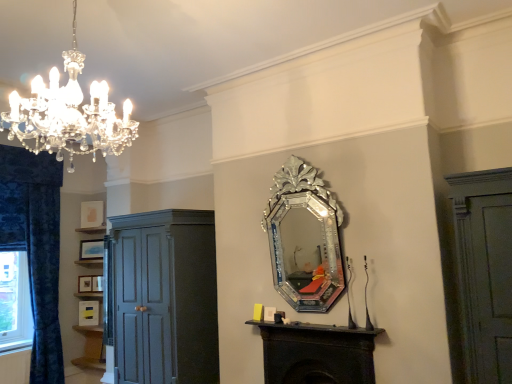
What do you see at coordinates (88, 313) in the screenshot? Image resolution: width=512 pixels, height=384 pixels. I see `matte yellow picture frame at lower left, the 1th picture frame positioned from the bottom` at bounding box center [88, 313].

How much space does matte white picture frame at center, the 3th picture frame viewed from the top, occupy horizontally?

matte white picture frame at center, the 3th picture frame viewed from the top, is 0.90 inches wide.

Locate an element on the screen. matte white picture frame at center, positioned as the third picture frame in bottom-to-top order is located at coordinates (97, 283).

What do you see at coordinates (44, 281) in the screenshot? The height and width of the screenshot is (384, 512). I see `blue velvet curtain at left` at bounding box center [44, 281].

Measure the distance between point (13, 340) and camera.

4.67 meters.

Describe the element at coordinates (69, 114) in the screenshot. I see `crystal glass chandelier at upper left` at that location.

In order to face matte gold picture frame at upper left, the first picture frame viewed from the top, should I rotate leftwards or rightwards?

To align with it, rotate left about 21.037°.

This screenshot has height=384, width=512. Identify the location of silver/glass mirror at center. (305, 252).

Measure the distance between point (x=322, y=243) and camera.

Point (x=322, y=243) is 3.44 meters away from camera.

The image size is (512, 384). What do you see at coordinates (91, 249) in the screenshot? I see `wooden picture frame at left, the fourth picture frame from the bottom` at bounding box center [91, 249].

Locate an element on the screen. matte yellow picture frame at lower left, which is the 5th picture frame from top to bottom is located at coordinates (88, 313).

From the image's perspective, is silver/glass mirror at center below matte dark gray cupboard at left?

No, from the image's perspective, silver/glass mirror at center is not beneath matte dark gray cupboard at left.

Does silver/glass mirror at center have a larger size compared to matte dark gray cupboard at left?

Actually, silver/glass mirror at center might be smaller than matte dark gray cupboard at left.

Is point (323, 298) closer to viewer compared to point (181, 360)?

Yes, point (323, 298) is in front of point (181, 360).

Considering the positions of objects silver/glass mirror at center and matte dark gray cupboard at left in the image provided, who is more to the left, silver/glass mirror at center or matte dark gray cupboard at left?

matte dark gray cupboard at left is more to the left.

Which is closer, (102,282) or (54,376)?

The point (102,282) is in front.

From a real-world perspective, is matte white picture frame at center, the 3th picture frame viewed from the top, positioned under blue velvet curtain at left based on gravity?

Yes, from a real-world perspective, matte white picture frame at center, the 3th picture frame viewed from the top, is under blue velvet curtain at left.

Would you say matte white picture frame at center, the 3th picture frame viewed from the top, is to the left or to the right of blue velvet curtain at left in the picture?

Clearly, matte white picture frame at center, the 3th picture frame viewed from the top, is on the right of blue velvet curtain at left in the image.

From the image's perspective, between matte white picture frame at center, positioned as the third picture frame in bottom-to-top order, and blue velvet curtain at left, which one is located above?

From the image's view, blue velvet curtain at left is above.

Would you say matte white picture frame at center, positioned as the third picture frame in bottom-to-top order, is a long distance from wooden picture frame at left, acting as the second picture frame starting from the top?

No, matte white picture frame at center, positioned as the third picture frame in bottom-to-top order, is not far away from wooden picture frame at left, acting as the second picture frame starting from the top.

From the image's perspective, is matte white picture frame at center, positioned as the third picture frame in bottom-to-top order, located above or below wooden picture frame at left, the fourth picture frame from the bottom?

From the image's perspective, matte white picture frame at center, positioned as the third picture frame in bottom-to-top order, appears below wooden picture frame at left, the fourth picture frame from the bottom.

Is matte white picture frame at center, the 3th picture frame viewed from the top, in front of or behind wooden picture frame at left, the fourth picture frame from the bottom, in the image?

matte white picture frame at center, the 3th picture frame viewed from the top, is in front of wooden picture frame at left, the fourth picture frame from the bottom.

Is matte white picture frame at center, positioned as the third picture frame in bottom-to-top order, bigger or smaller than wooden picture frame at left, the fourth picture frame from the bottom?

Considering their sizes, matte white picture frame at center, positioned as the third picture frame in bottom-to-top order, takes up less space than wooden picture frame at left, the fourth picture frame from the bottom.

From the image's perspective, which one is positioned higher, wooden picture frame at left, acting as the second picture frame starting from the top, or matte yellow picture frame at lower left, which is the 5th picture frame from top to bottom?

wooden picture frame at left, acting as the second picture frame starting from the top, appears higher in the image.

Considering the positions of points (90, 250) and (86, 322), is point (90, 250) farther from camera compared to point (86, 322)?

That is True.

The width and height of the screenshot is (512, 384). In order to click on picture frame that is the 1st one when counting leftward from the wooden picture frame at left, the fourth picture frame from the bottom in this screenshot , I will do `click(88, 313)`.

Looking at the image, does wooden picture frame at left, the fourth picture frame from the bottom, seem bigger or smaller compared to matte yellow picture frame at lower left, which is the 5th picture frame from top to bottom?

wooden picture frame at left, the fourth picture frame from the bottom, is bigger than matte yellow picture frame at lower left, which is the 5th picture frame from top to bottom.

Which is behind, point (298, 290) or point (371, 332)?

Point (298, 290)

Is silver/glass mirror at center not within black stone fireplace at center?

Yes.

Identify the location of mirror on the left of black stone fireplace at center. point(305,252).

Is silver/glass mirror at center oriented towards black stone fireplace at center?

No, silver/glass mirror at center is not facing towards black stone fireplace at center.

From a real-world perspective, is silver/glass mirror at center physically located above or below matte gold picture frame at left, placed as the 4th picture frame when sorted from top to bottom?

Clearly, from a real-world perspective, silver/glass mirror at center is above matte gold picture frame at left, placed as the 4th picture frame when sorted from top to bottom.

Is matte gold picture frame at left, marked as the 2th picture frame in a bottom-to-top arrangement, at the back of silver/glass mirror at center?

No, silver/glass mirror at center is not facing away from matte gold picture frame at left, marked as the 2th picture frame in a bottom-to-top arrangement.

Who is bigger, silver/glass mirror at center or matte gold picture frame at left, marked as the 2th picture frame in a bottom-to-top arrangement?

silver/glass mirror at center is bigger.

Which is more to the right, silver/glass mirror at center or matte gold picture frame at left, marked as the 2th picture frame in a bottom-to-top arrangement?

silver/glass mirror at center.

Is black stone fireplace at center beside crystal glass chandelier at upper left?

No, black stone fireplace at center is not next to crystal glass chandelier at upper left.

Could you tell me if black stone fireplace at center is turned towards crystal glass chandelier at upper left?

No, black stone fireplace at center is not aimed at crystal glass chandelier at upper left.

Which object is thinner, black stone fireplace at center or crystal glass chandelier at upper left?

Thinner between the two is black stone fireplace at center.

Does point (268, 381) lie behind point (45, 87)?

Yes, point (268, 381) is farther from viewer.

Where is `cupboard lying behind the silver/glass mirror at center`? Image resolution: width=512 pixels, height=384 pixels. cupboard lying behind the silver/glass mirror at center is located at coordinates (162, 297).

You are a GUI agent. You are given a task and a screenshot of the screen. Output one action in this format:
    pyautogui.click(x=<x>, y=<y>)
    Task: Click on the curtain above the matte white picture frame at center, the 3th picture frame viewed from the top (from the image's perspective)
    The width and height of the screenshot is (512, 384).
    Given the screenshot: What is the action you would take?
    pyautogui.click(x=44, y=281)

Based on their spatial positions, is matte gold picture frame at upper left, which ranks as the fifth picture frame in bottom-to-top order, or blue velvet curtain at left further from matte dark gray cupboard at left?

matte gold picture frame at upper left, which ranks as the fifth picture frame in bottom-to-top order, is positioned further to the anchor matte dark gray cupboard at left.

Considering their positions, is blue velvet curtain at left positioned further to wooden picture frame at left, the fourth picture frame from the bottom, than blue textured curtain at left?

Based on the image, blue textured curtain at left appears to be further to wooden picture frame at left, the fourth picture frame from the bottom.

When comparing their distances from black stone fireplace at center, does matte gold picture frame at upper left, the first picture frame viewed from the top, or matte gold picture frame at left, marked as the 2th picture frame in a bottom-to-top arrangement, seem closer?

matte gold picture frame at left, marked as the 2th picture frame in a bottom-to-top arrangement, is closer to black stone fireplace at center.

Estimate the real-world distances between objects in this image. Which object is closer to blue textured curtain at left, matte gold picture frame at left, placed as the 4th picture frame when sorted from top to bottom, or silver/glass mirror at center?

matte gold picture frame at left, placed as the 4th picture frame when sorted from top to bottom, is closer to blue textured curtain at left.

Estimate the real-world distances between objects in this image. Which object is further from matte dark gray cupboard at left, blue textured curtain at left or crystal glass chandelier at upper left?

crystal glass chandelier at upper left.

From the image, which object appears to be farther from blue velvet curtain at left, crystal glass chandelier at upper left or black stone fireplace at center?

crystal glass chandelier at upper left lies further to blue velvet curtain at left than the other object.

Looking at the image, which one is located closer to matte white picture frame at center, positioned as the third picture frame in bottom-to-top order, matte dark gray cupboard at left or wooden picture frame at left, the fourth picture frame from the bottom?

→ wooden picture frame at left, the fourth picture frame from the bottom, is closer to matte white picture frame at center, positioned as the third picture frame in bottom-to-top order.

From the image, which object appears to be farther from matte gold picture frame at upper left, which ranks as the fifth picture frame in bottom-to-top order, crystal glass chandelier at upper left or blue textured curtain at left?

crystal glass chandelier at upper left.

What are the coordinates of `cupboard positioned between crystal glass chandelier at upper left and matte gold picture frame at upper left, the first picture frame viewed from the top, from near to far` in the screenshot? It's located at (162, 297).

You are a GUI agent. You are given a task and a screenshot of the screen. Output one action in this format:
    pyautogui.click(x=<x>, y=<y>)
    Task: Click on the window between blue velvet curtain at left and matte gold picture frame at upper left, the first picture frame viewed from the top, in the front-back direction
    This screenshot has width=512, height=384.
    Given the screenshot: What is the action you would take?
    pyautogui.click(x=15, y=301)

This screenshot has width=512, height=384. Identify the location of table between crystal glass chandelier at upper left and matte gold picture frame at upper left, the first picture frame viewed from the top, in the front-back direction. (317, 353).

Find the location of a particular element. This screenshot has height=384, width=512. window between crystal glass chandelier at upper left and wooden picture frame at left, acting as the second picture frame starting from the top, from front to back is located at coordinates (15, 301).